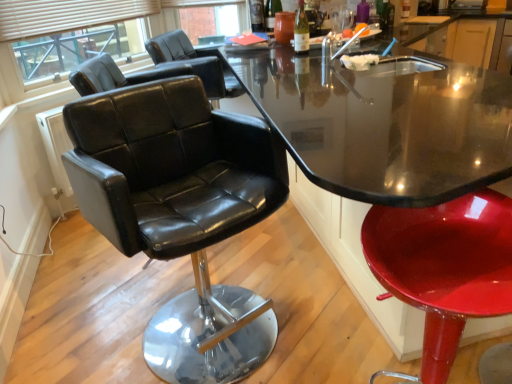
Question: Based on their positions, is black leather chair at center, placed as the third chair when sorted from front to back, located to the left or right of white glass bottle at upper center?

Choices:
 (A) left
 (B) right

Answer: (A)

Question: Is black leather chair at center, which ranks as the first chair in back-to-front order, inside the boundaries of white glass bottle at upper center, or outside?

Choices:
 (A) outside
 (B) inside

Answer: (A)

Question: Estimate the real-world distances between objects in this image. Which object is farther from the glossy red stool at lower right, which is counted as the third chair, starting from the back?

Choices:
 (A) black leather chair at left, which is counted as the second chair, starting from the back
 (B) black leather chair at center, which ranks as the first chair in back-to-front order
 (C) black leather chairs at upper left
 (D) glossy black table at center
 (E) white glass bottle at upper center

Answer: (C)

Question: Which is nearer to the glossy black table at center?

Choices:
 (A) glossy red stool at lower right, the 1th chair when ordered from front to back
 (B) black leather chair at center, placed as the third chair when sorted from front to back
 (C) white glass bottle at upper center
 (D) black leather chairs at upper left
 (E) black leather chair at left, which is the second chair from front to back

Answer: (C)